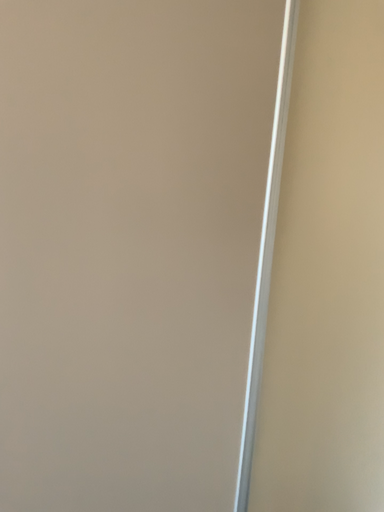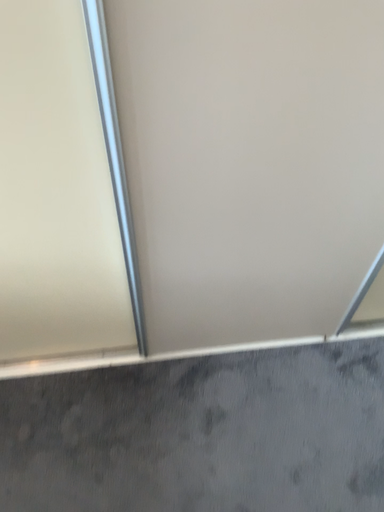
Question: Which way did the camera rotate in the video?

Choices:
 (A) rotated right
 (B) rotated left

Answer: (B)